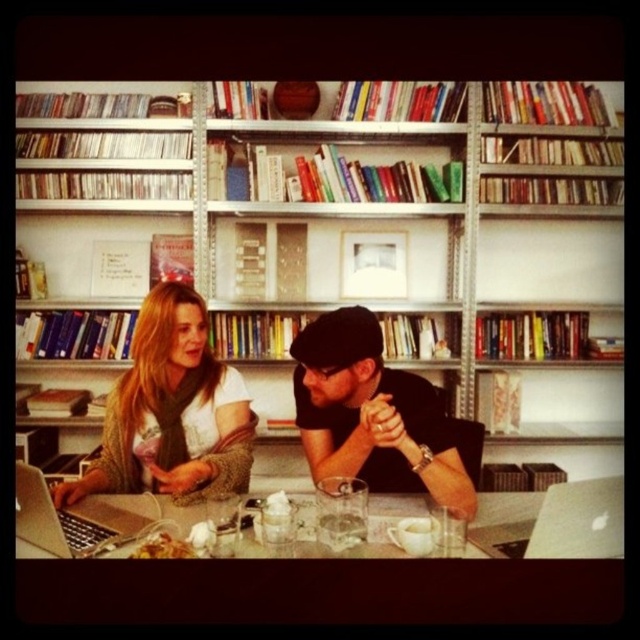
Question: Which point appears farthest from the camera in this image?

Choices:
 (A) (221, 364)
 (B) (177, 449)
 (C) (275, 412)
 (D) (428, 442)

Answer: (C)

Question: Which of the following is the closest to the observer?

Choices:
 (A) matte white scarf at center
 (B) wooden table at center

Answer: (B)

Question: Is black matte hat at center in front of silver metallic laptop at lower left?

Choices:
 (A) no
 (B) yes

Answer: (A)

Question: Does black matte hat at center lie in front of silver metallic laptop at lower left?

Choices:
 (A) no
 (B) yes

Answer: (A)

Question: Does white wooden bookcase at upper center appear over black matte hat at center?

Choices:
 (A) no
 (B) yes

Answer: (B)

Question: Which of the following is the closest to the observer?

Choices:
 (A) matte white scarf at center
 (B) white wooden bookcase at upper center
 (C) wooden table at center
 (D) matte black laptop at center

Answer: (C)